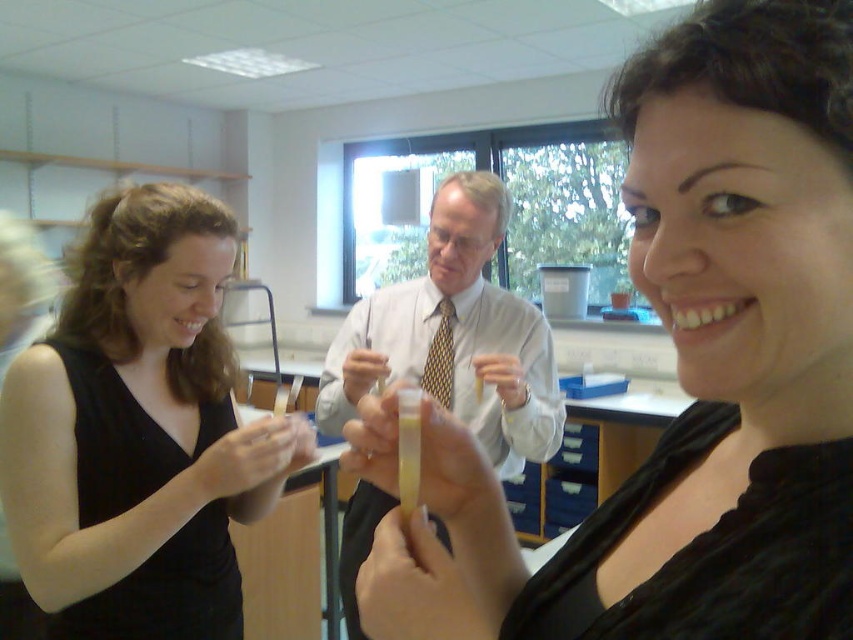
You are an observer in a lab. You see a black matte dress at left and a white shirt at center. Which clothing item has a smaller width?

The black matte dress at left is thinner than the white shirt at center, so the black matte dress at left has a smaller width.